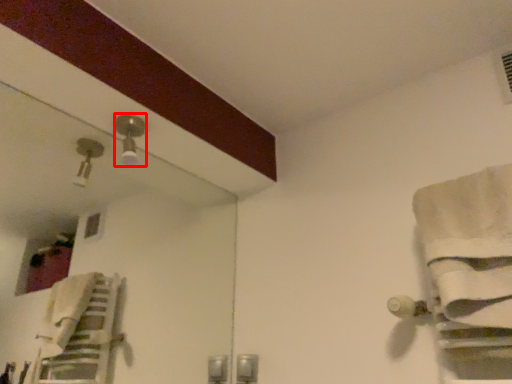
Question: From the image's perspective, where is light fixture (annotated by the red box) located relative to bath towel?

Choices:
 (A) below
 (B) above

Answer: (B)